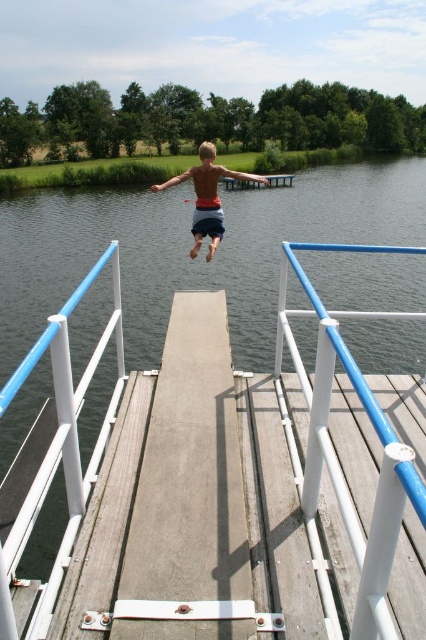
Question: Considering the relative positions of white plastic rail at center and orange t-shirt at center in the image provided, where is white plastic rail at center located with respect to orange t-shirt at center?

Choices:
 (A) above
 (B) below

Answer: (B)

Question: Which of the following is the closest to the observer?

Choices:
 (A) (78, 202)
 (B) (356, 540)

Answer: (B)

Question: Observing the image, what is the correct spatial positioning of transparent water at center in reference to orange t-shirt at center?

Choices:
 (A) below
 (B) above

Answer: (A)

Question: Which is farther from the white plastic rail at center?

Choices:
 (A) orange t-shirt at center
 (B) transparent water at center

Answer: (B)

Question: Which object appears closest to the camera in this image?

Choices:
 (A) orange t-shirt at center
 (B) transparent water at center
 (C) white plastic rail at center

Answer: (C)

Question: Is transparent water at center above orange t-shirt at center?

Choices:
 (A) no
 (B) yes

Answer: (A)